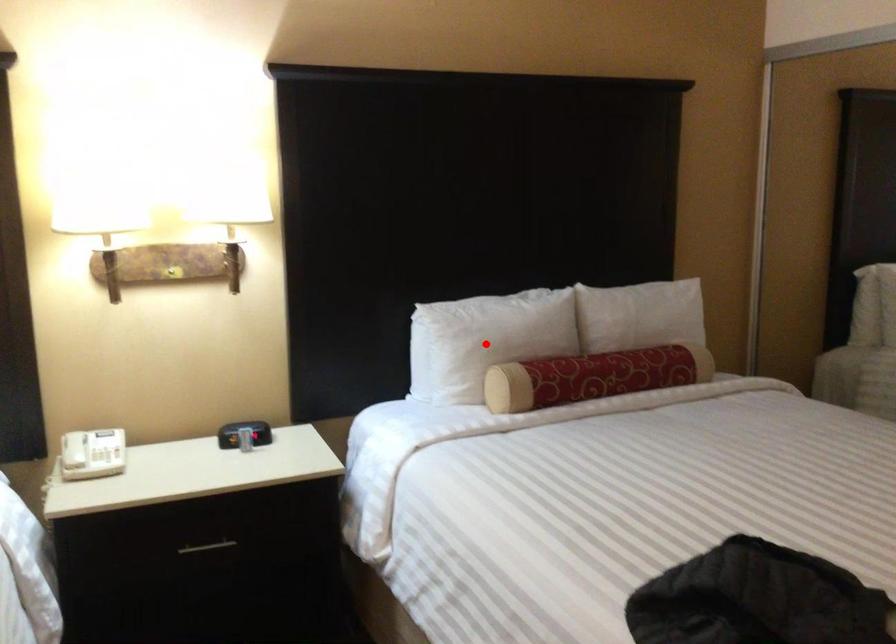
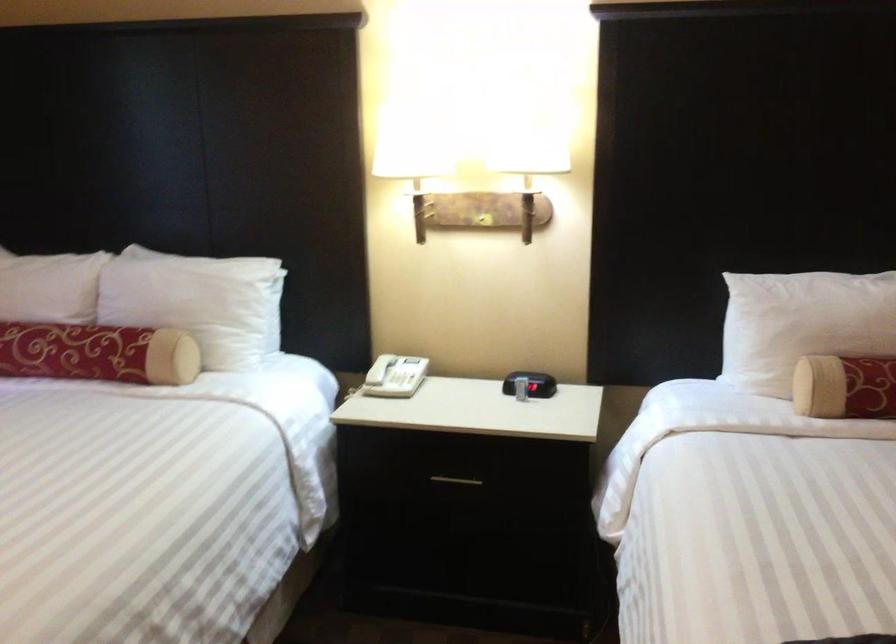
Question: I am providing you with two images of the same scene from different viewpoints. Given a red point in image1, look at the same physical point in image2. Is it:

Choices:
 (A) Closer to the viewpoint
 (B) Farther from the viewpoint

Answer: (A)